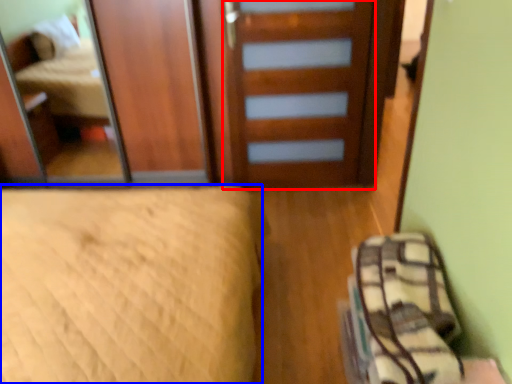
Question: Which object is closer to the camera taking this photo, door (highlighted by a red box) or bed (highlighted by a blue box)?

Choices:
 (A) door
 (B) bed

Answer: (B)